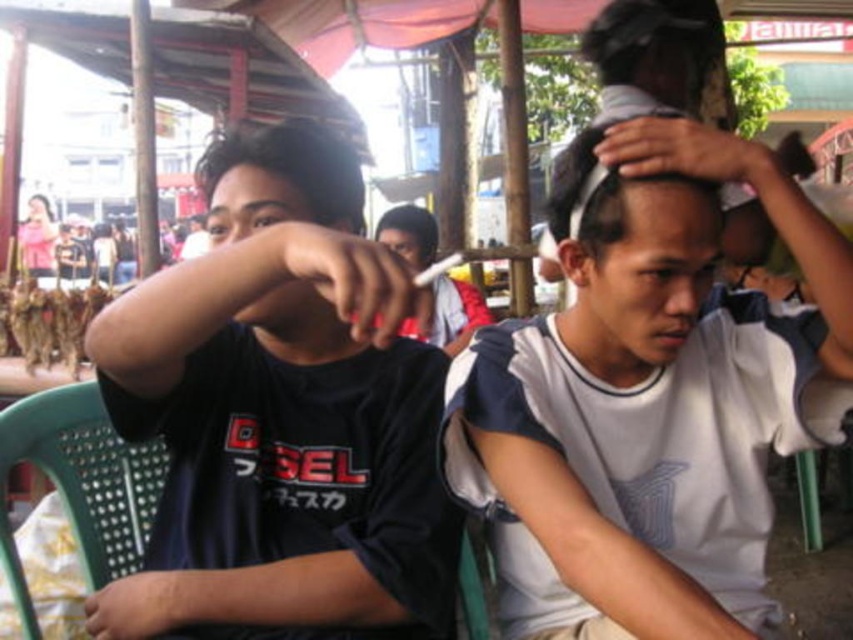
Question: Is white matte shirt at center closer to camera compared to dark brown hair at upper left?

Choices:
 (A) yes
 (B) no

Answer: (B)

Question: Does black matte shirt at left have a greater width compared to dark brown hair at upper left?

Choices:
 (A) yes
 (B) no

Answer: (A)

Question: Which point is farther to the camera?

Choices:
 (A) (97, 484)
 (B) (672, 116)
 (C) (822, 362)
 (D) (381, 216)

Answer: (D)

Question: Estimate the real-world distances between objects in this image. Which object is closer to the black matte shirt at left?

Choices:
 (A) white matte head at center
 (B) green plastic chair at lower left

Answer: (B)

Question: Which point is closer to the camera?

Choices:
 (A) green plastic chair at lower left
 (B) white matte head at center

Answer: (B)

Question: Is black matte shirt at left positioned before white matte head at center?

Choices:
 (A) yes
 (B) no

Answer: (A)